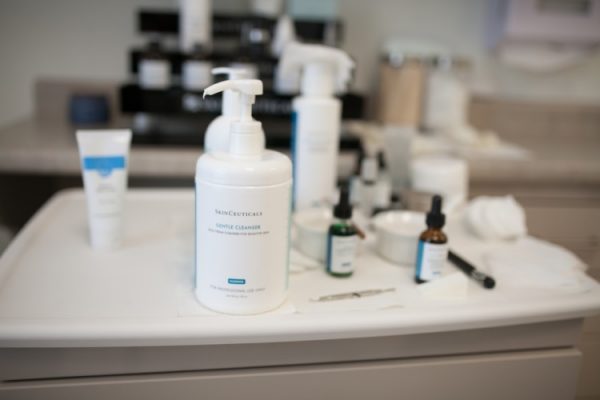
Image resolution: width=600 pixels, height=400 pixels. Identify the location of white wall. coord(85,40).